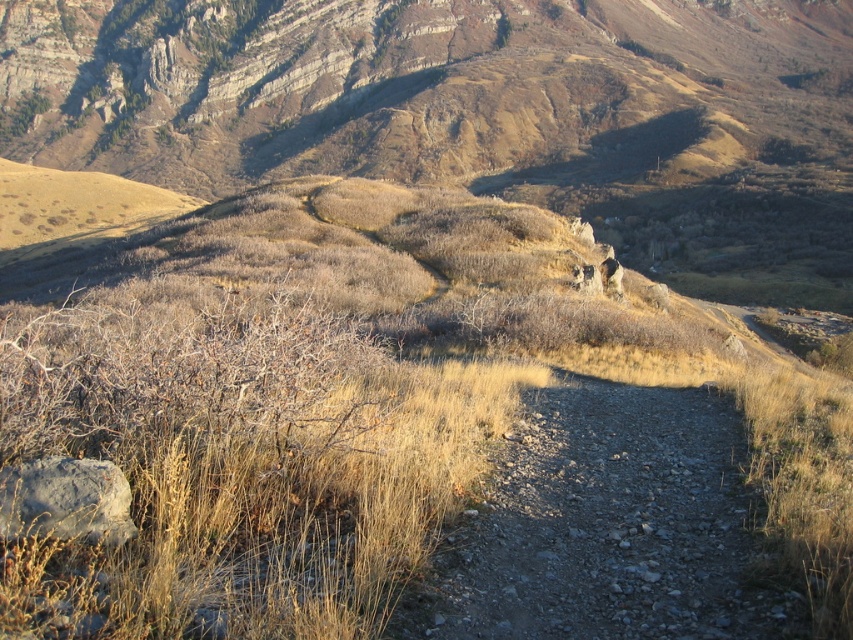
Is dry grass at center to the right of dusty gravel path at center from the viewer's perspective?

Incorrect, dry grass at center is not on the right side of dusty gravel path at center.

The image size is (853, 640). What do you see at coordinates (368, 413) in the screenshot?
I see `dry grass at center` at bounding box center [368, 413].

The height and width of the screenshot is (640, 853). What are the coordinates of `dry grass at center` in the screenshot? It's located at (x=368, y=413).